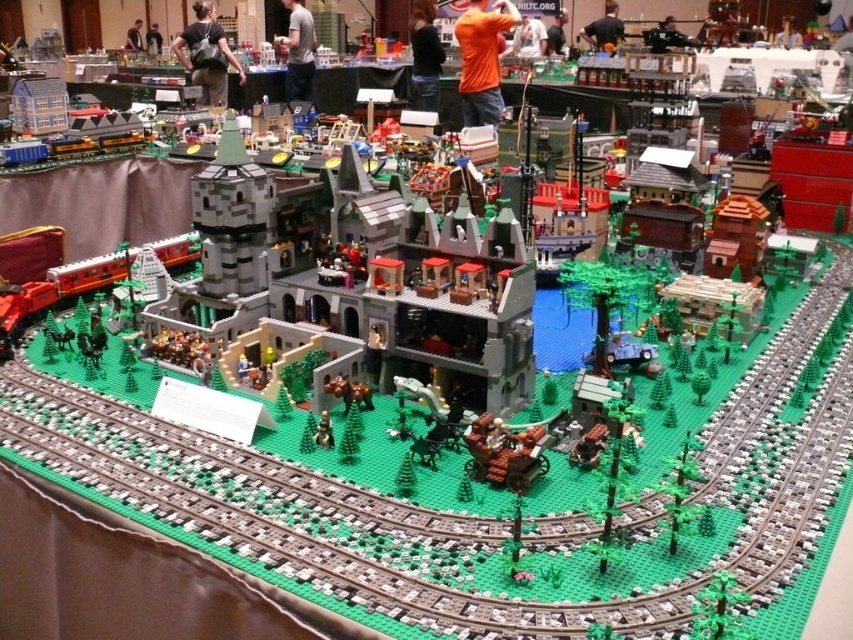
Is black leather jacket at center taller than smooth white shirt at center?

Indeed, black leather jacket at center has a greater height compared to smooth white shirt at center.

Who is positioned more to the right, black leather jacket at center or smooth white shirt at center?

Positioned to the right is smooth white shirt at center.

The width and height of the screenshot is (853, 640). What do you see at coordinates (425, 54) in the screenshot?
I see `black leather jacket at center` at bounding box center [425, 54].

At what (x,y) coordinates should I click in order to perform the action: click on black leather jacket at center. Please return your answer as a coordinate pair (x, y). Looking at the image, I should click on (425, 54).

Can you confirm if gray cotton shirt at center is positioned below smooth white shirt at center?

Indeed, gray cotton shirt at center is positioned under smooth white shirt at center.

How distant is gray cotton shirt at center from smooth white shirt at center?

gray cotton shirt at center and smooth white shirt at center are 3.45 feet apart.

Locate an element on the screen. gray cotton shirt at center is located at coordinates (299, 51).

From the picture: Does matte black shirt at upper center have a greater height compared to matte black shirt at center?

Incorrect, matte black shirt at upper center's height is not larger of matte black shirt at center's.

Does matte black shirt at upper center appear under matte black shirt at center?

Actually, matte black shirt at upper center is above matte black shirt at center.

Who is more distant from viewer, (142, 49) or (151, 45)?

Positioned behind is point (142, 49).

Locate an element on the screen. The height and width of the screenshot is (640, 853). matte black shirt at upper center is located at coordinates (134, 36).